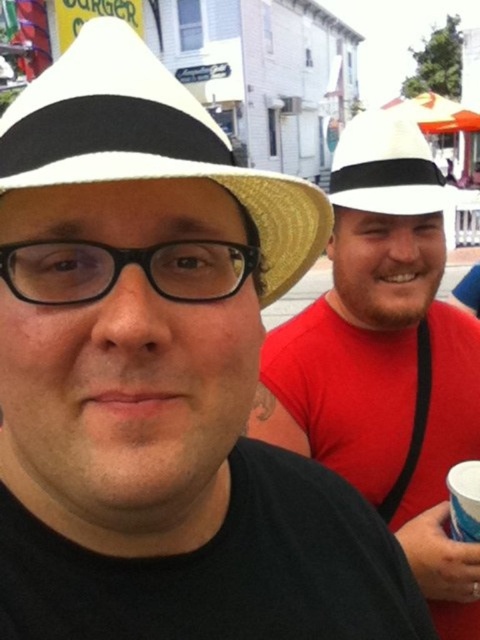
Does white matte fedora at right have a greater width compared to white matte cowboy hat at upper right?

No.

The width and height of the screenshot is (480, 640). What do you see at coordinates (385, 360) in the screenshot?
I see `white matte fedora at right` at bounding box center [385, 360].

The image size is (480, 640). What are the coordinates of `white matte fedora at right` in the screenshot? It's located at (385, 360).

In the scene shown: Who is shorter, white matte fedora at right or straw hat at center?

With less height is straw hat at center.

Does white matte fedora at right have a greater height compared to straw hat at center?

Indeed, white matte fedora at right has a greater height compared to straw hat at center.

Does point (456, 552) come in front of point (121, 54)?

That is False.

Locate an element on the screen. The image size is (480, 640). white matte fedora at right is located at coordinates (385, 360).

Which is more to the right, straw hat at center or white matte cowboy hat at upper right?

white matte cowboy hat at upper right

Does straw hat at center appear under white matte cowboy hat at upper right?

Correct, straw hat at center is located below white matte cowboy hat at upper right.

Is point (175, 173) farther from viewer compared to point (411, 145)?

That is False.

Identify the location of straw hat at center. The width and height of the screenshot is (480, 640). (149, 144).